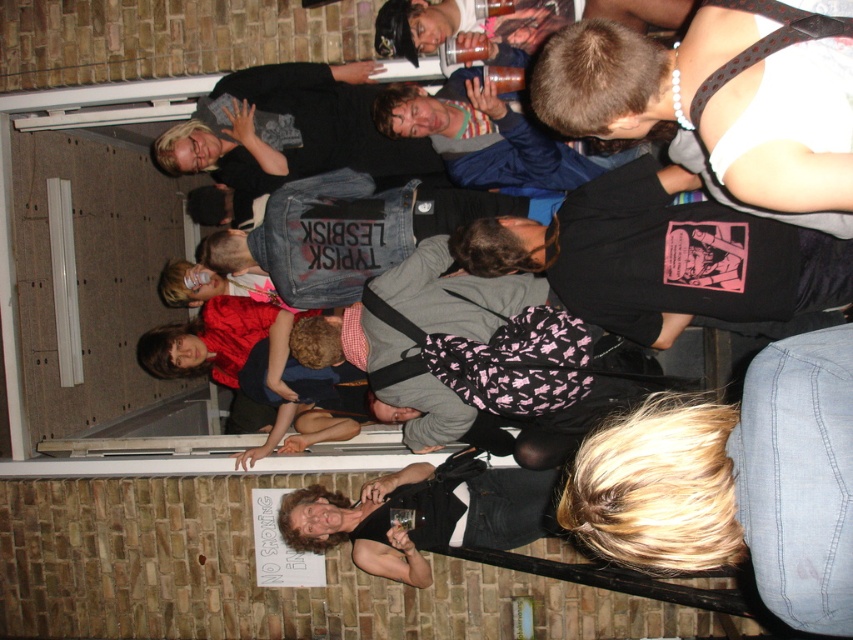
Question: Is black denim shirt at upper right wider than shiny black shirt at lower center?

Choices:
 (A) no
 (B) yes

Answer: (A)

Question: Which object is the closest to the black denim shirt at upper right?

Choices:
 (A) denim jacket at center
 (B) shiny black shirt at lower center

Answer: (A)

Question: Which object appears farthest from the camera in this image?

Choices:
 (A) denim jacket at center
 (B) shiny black shirt at lower center
 (C) black denim shirt at upper right

Answer: (A)

Question: Does black denim shirt at upper right have a greater width compared to shiny black shirt at lower center?

Choices:
 (A) yes
 (B) no

Answer: (B)

Question: Can you confirm if black denim shirt at upper right is bigger than denim jacket at center?

Choices:
 (A) no
 (B) yes

Answer: (A)

Question: Which of the following is the farthest from the observer?

Choices:
 (A) (300, 492)
 (B) (409, 253)

Answer: (B)